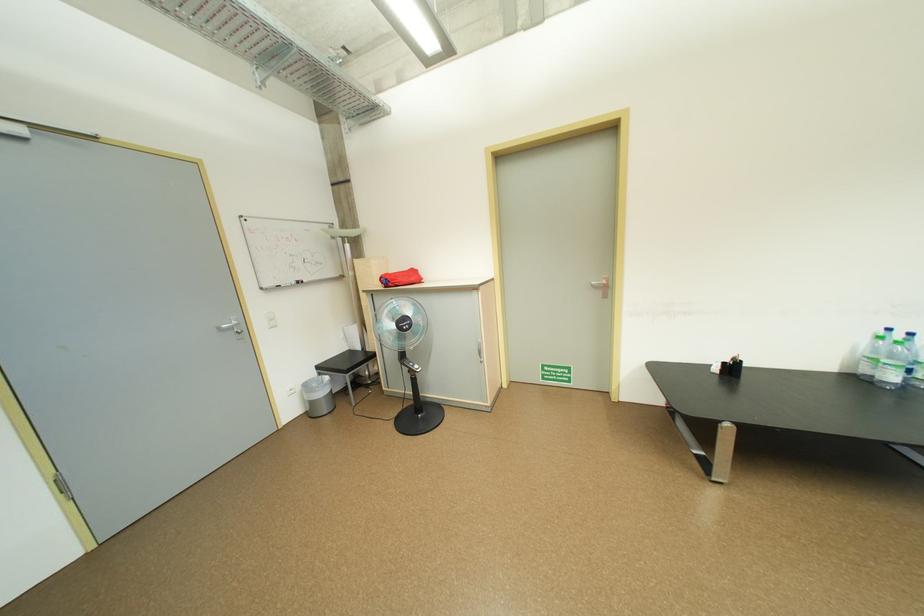
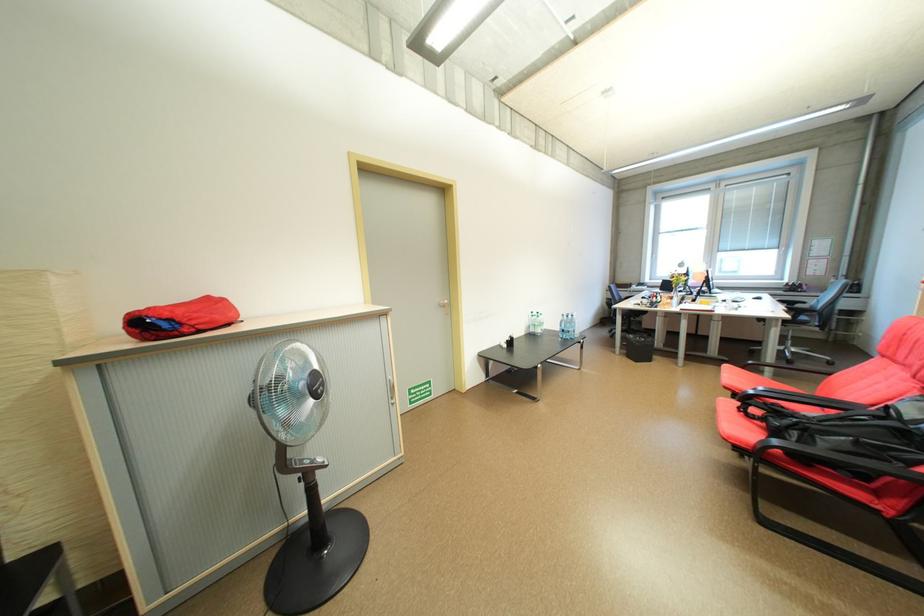
The point at (873, 370) is marked in the first image. Where is the corresponding point in the second image?

(541, 331)